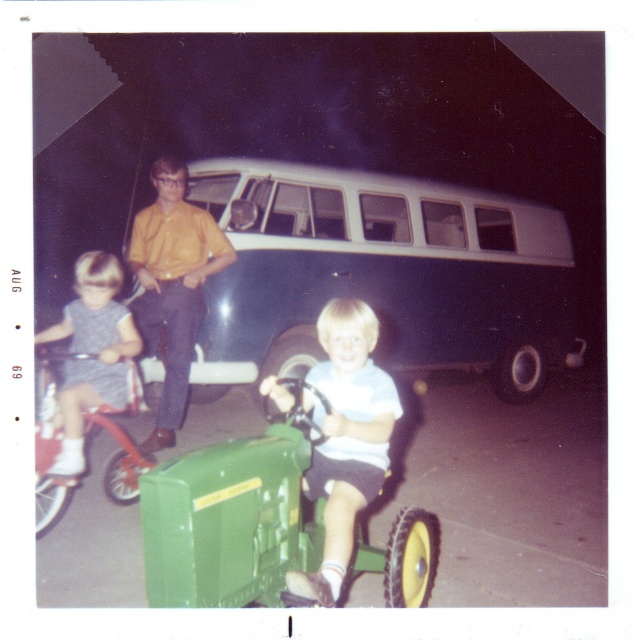
You are a delivery person who needs to park your vehicle in a tight space between the blue matte van at center and the green plastic tractor at center. The space between them is exactly 2 meters. Your delivery truck is 1.8 meters wide. Can you safely park your truck in this space without touching either vehicle?

The blue matte van at center is wider than the green plastic tractor at center. Since the space between them is 2 meters and your truck is 1.8 meters wide, you can safely park your truck in the space as long as you position it away from the wider van and ensure there is enough clearance on both sides.